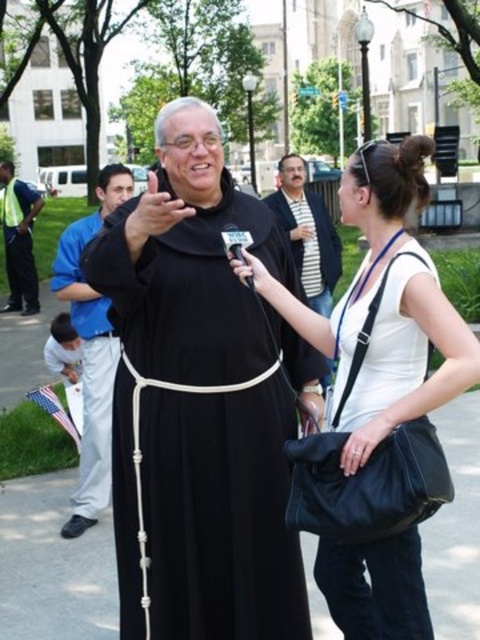
Question: Which of the following is the farthest from the observer?

Choices:
 (A) (304, 593)
 (B) (76, 275)
 (C) (298, 246)

Answer: (C)

Question: Which object appears closest to the camera in this image?

Choices:
 (A) white matte bag at center
 (B) black matte robe at center

Answer: (A)

Question: Is white matte bag at center to the right of black matte suit at center from the viewer's perspective?

Choices:
 (A) no
 (B) yes

Answer: (A)

Question: Which point is closer to the camera taking this photo?

Choices:
 (A) (12, 196)
 (B) (123, 198)
 (C) (199, 227)
 (D) (317, 280)

Answer: (C)

Question: Is black matte dress at center below black matte robe at center?

Choices:
 (A) yes
 (B) no

Answer: (A)

Question: Can you confirm if white matte bag at center is positioned above black matte suit at center?

Choices:
 (A) yes
 (B) no

Answer: (B)